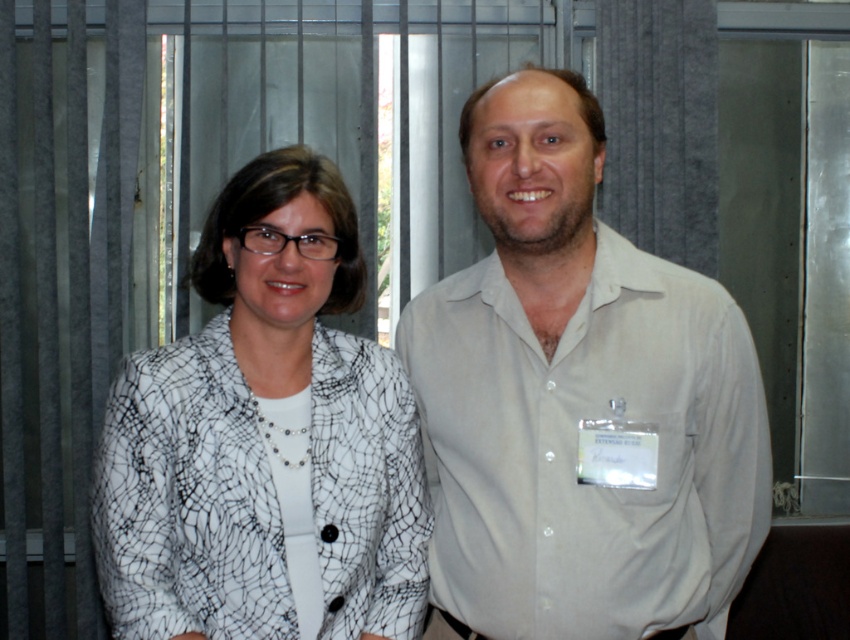
Is light beige shirt at center bigger than white textured blazer at center?

Yes, light beige shirt at center is bigger than white textured blazer at center.

You are a GUI agent. You are given a task and a screenshot of the screen. Output one action in this format:
    pyautogui.click(x=<x>, y=<y>)
    Task: Click on the light beige shirt at center
    
    Given the screenshot: What is the action you would take?
    pyautogui.click(x=578, y=397)

You are a GUI agent. You are given a task and a screenshot of the screen. Output one action in this format:
    pyautogui.click(x=<x>, y=<y>)
    Task: Click on the light beige shirt at center
    
    Given the screenshot: What is the action you would take?
    pyautogui.click(x=578, y=397)